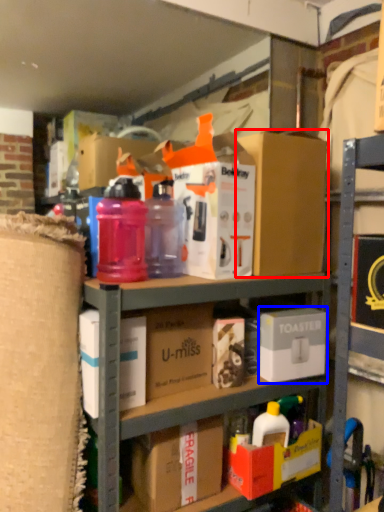
Question: Which object appears farthest to the camera in this image, box (highlighted by a red box) or box (highlighted by a blue box)?

Choices:
 (A) box
 (B) box

Answer: (B)